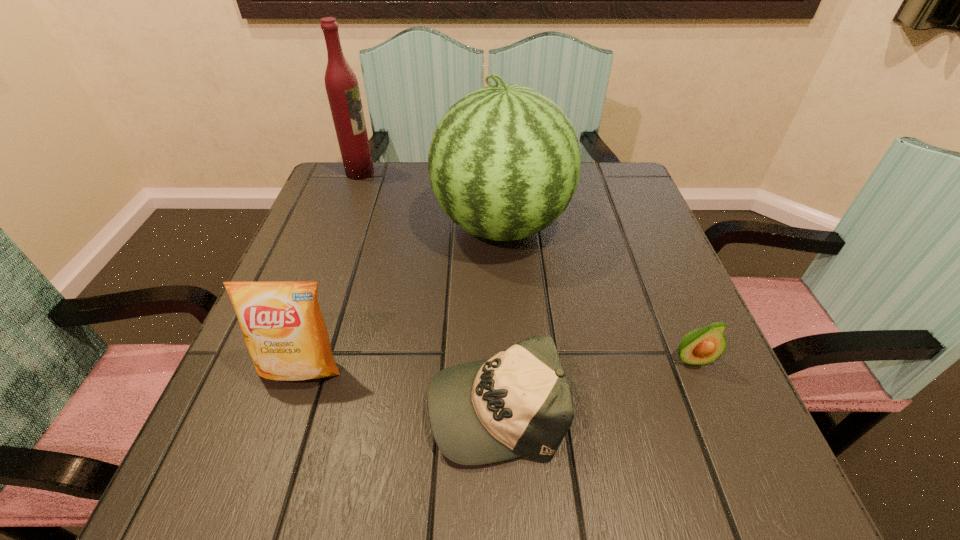
I want to click on the farthest object, so coord(341,84).

Locate an element on the screen. This screenshot has height=540, width=960. the second farthest object is located at coordinates (504, 162).

Identify the location of crisp (potato chip). point(282,324).

This screenshot has width=960, height=540. Find the location of `the rightmost object`. the rightmost object is located at coordinates (702, 346).

Locate an element on the screen. This screenshot has height=540, width=960. the shortest object is located at coordinates (518, 403).

Identify the location of vacant space located on the label of the farthest object. The height and width of the screenshot is (540, 960). (476, 173).

Where is `blank space located 0.090m on the front of the watermelon`? The width and height of the screenshot is (960, 540). blank space located 0.090m on the front of the watermelon is located at coordinates (506, 305).

Locate an element on the screen. This screenshot has width=960, height=540. free space located on the front-facing side of the third shortest object is located at coordinates (276, 444).

This screenshot has height=540, width=960. Identify the location of free spot located 0.160m on the cut side of the avocado. (737, 468).

The image size is (960, 540). I want to click on free spot located 0.300m on the front-facing side of the baseball cap, so click(x=235, y=405).